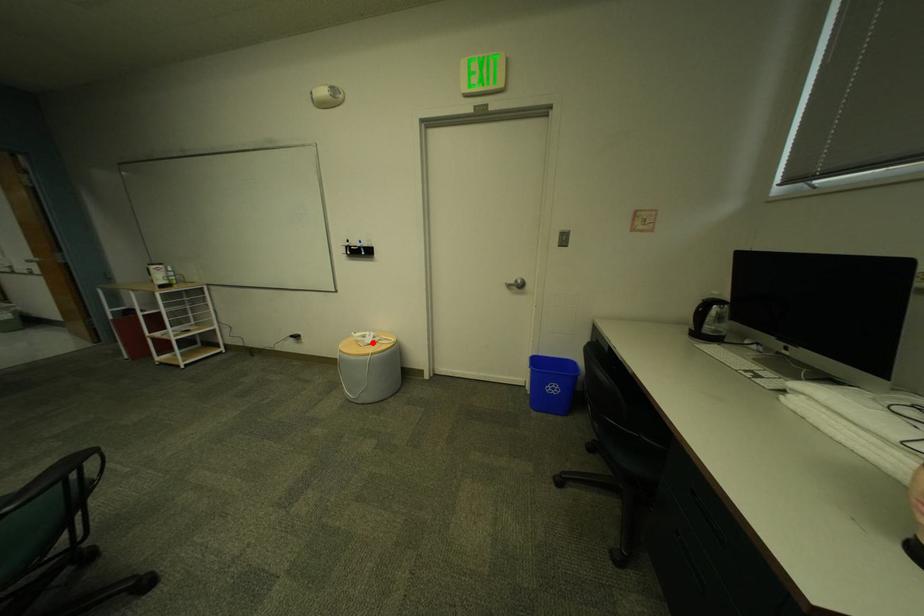
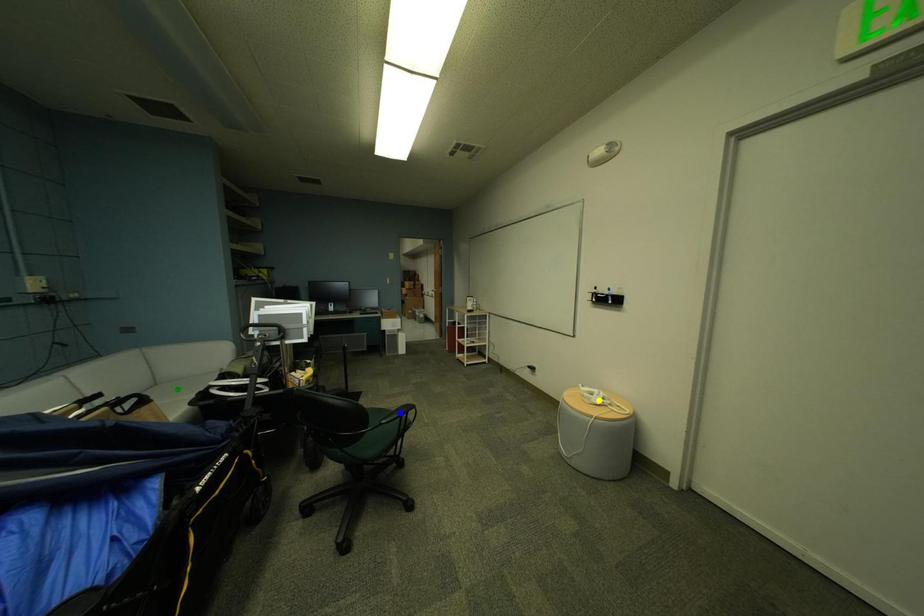
Question: I am providing you with two images of the same scene from different viewpoints. A red point is marked on the first image. You are given multiple points on the second image. Which spot in image 2 lines up with the point in image 1?

Choices:
 (A) blue point
 (B) yellow point
 (C) green point

Answer: (B)